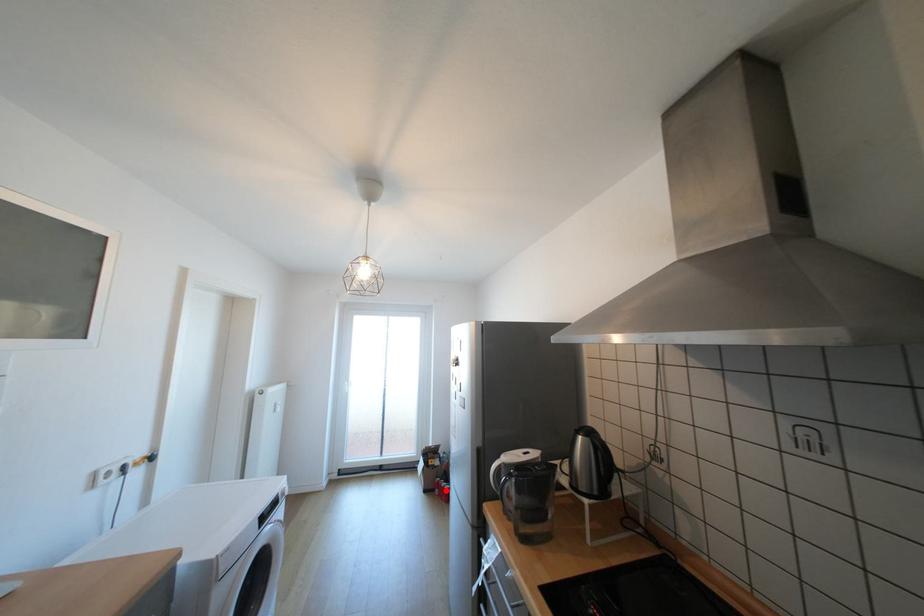
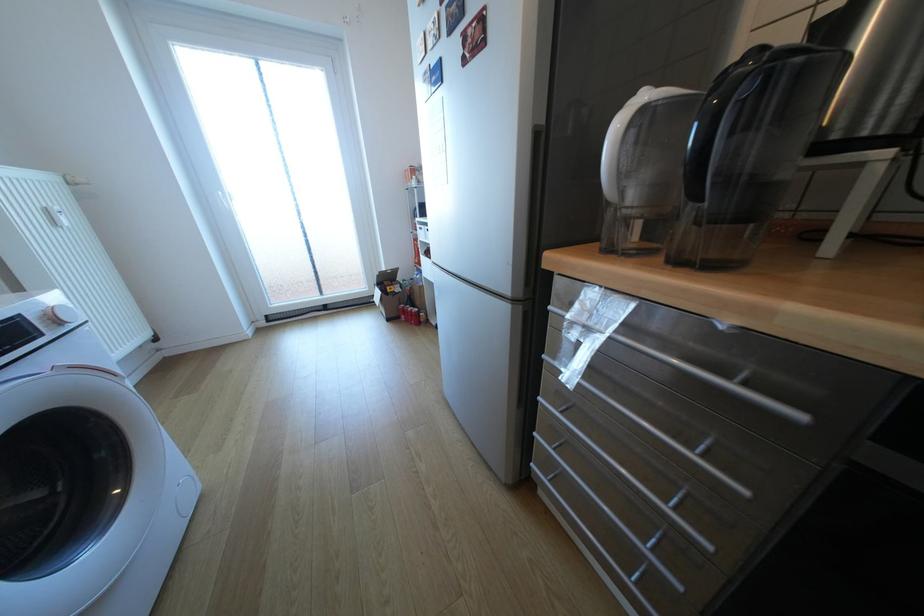
Question: I am providing you with two images of the same scene from different viewpoints. Image1 has a red point marked. In image2, the corresponding 3D location appears at what relative position? Reply with the corresponding letter.

Choices:
 (A) Closer
 (B) Farther

Answer: (A)